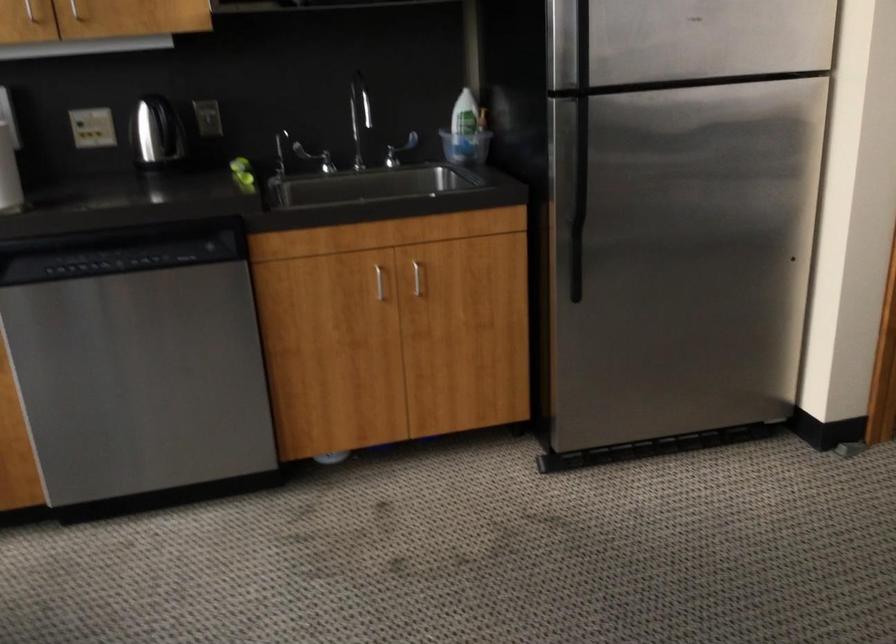
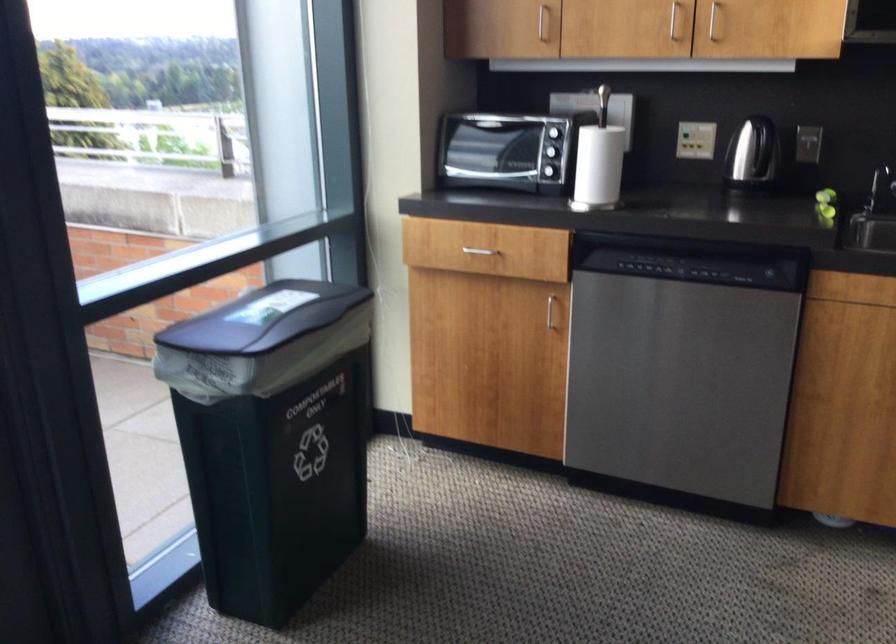
The point at (279, 158) is marked in the first image. Where is the corresponding point in the second image?

(879, 187)